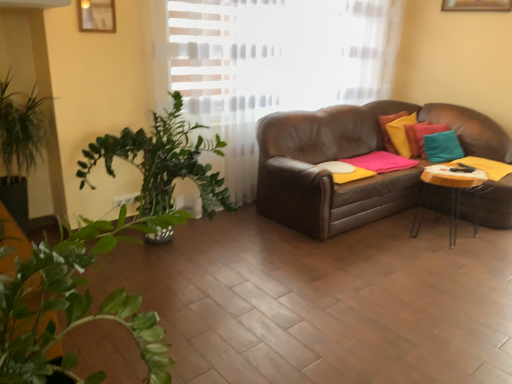
Question: Relative to teal fabric pillow at upper right, is wooden picture frame at upper left in front or behind?

Choices:
 (A) front
 (B) behind

Answer: (A)

Question: From the image's perspective, relative to teal fabric pillow at upper right, is wooden picture frame at upper left above or below?

Choices:
 (A) above
 (B) below

Answer: (A)

Question: Based on their relative distances, which object is farther from the teal fabric pillow at upper right?

Choices:
 (A) yellow matte table at right
 (B) wooden picture frame at upper left

Answer: (B)

Question: Considering the real-world distances, which object is closest to the wooden picture frame at upper left?

Choices:
 (A) teal fabric pillow at upper right
 (B) yellow matte table at right

Answer: (B)